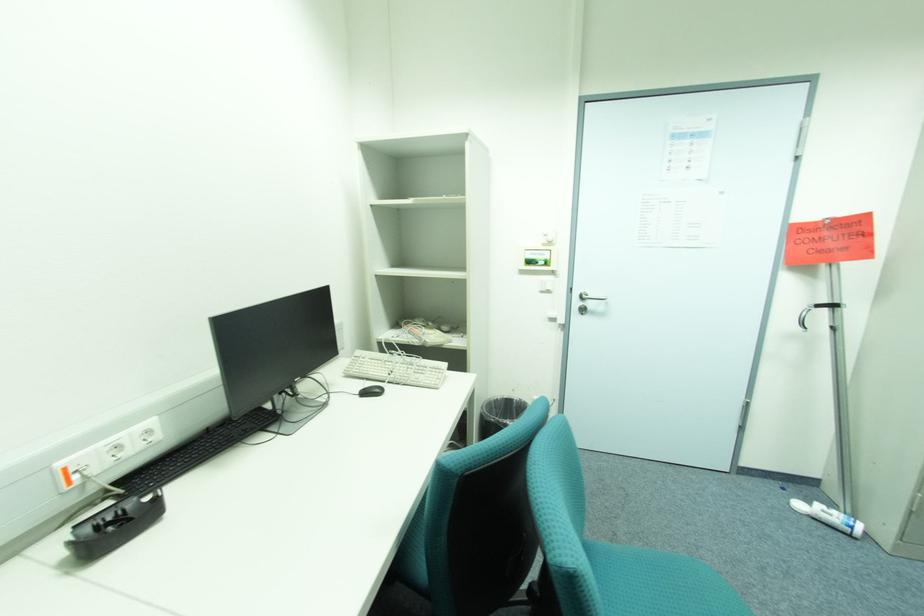
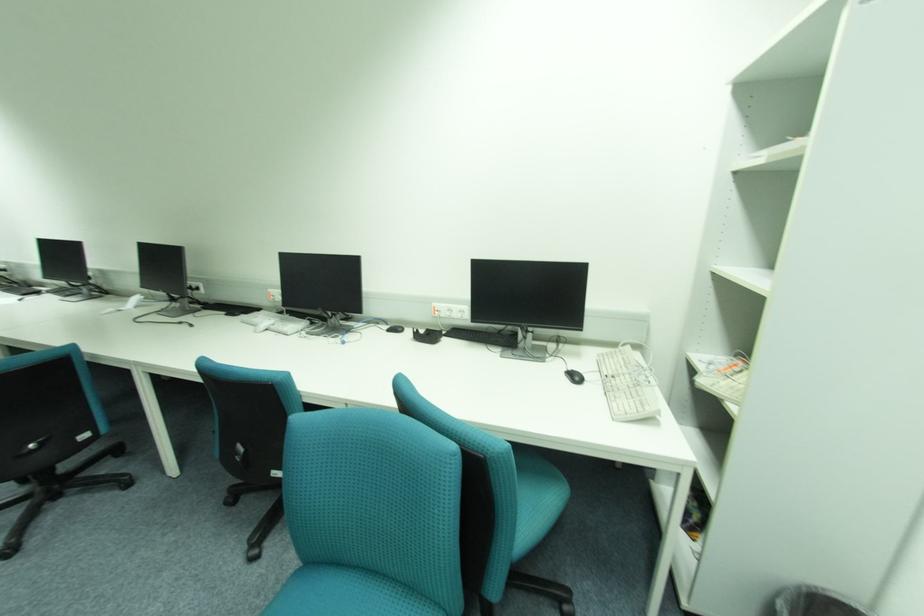
Find the pixel in the second image that matches pixel 492 403 in the first image.

(837, 594)